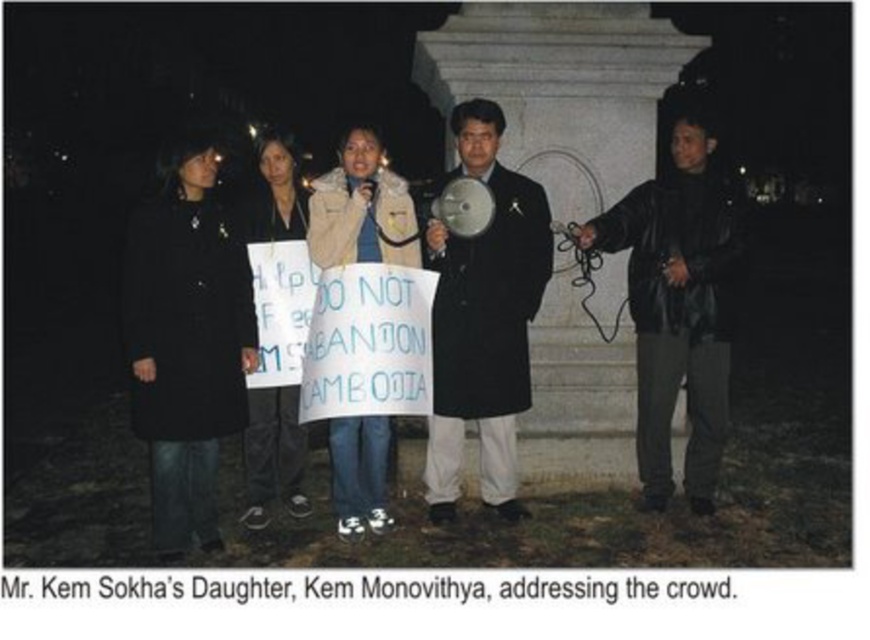
Question: Which object is farther from the camera taking this photo?

Choices:
 (A) black matte coat at center
 (B) beige fleece jacket at center

Answer: (B)

Question: Is leather jacket at right behind black fabric jacket at center?

Choices:
 (A) yes
 (B) no

Answer: (A)

Question: Which object is the closest to the matte black coat at center?

Choices:
 (A) leather jacket at right
 (B) black fabric jacket at center

Answer: (B)

Question: Which of these objects is positioned farthest from the black fabric jacket at center?

Choices:
 (A) leather jacket at right
 (B) beige fleece jacket at center
 (C) matte black coat at center

Answer: (A)

Question: Is leather jacket at right to the right of beige fleece jacket at center from the viewer's perspective?

Choices:
 (A) no
 (B) yes

Answer: (B)

Question: Can you confirm if black matte coat at center is bigger than beige fleece jacket at center?

Choices:
 (A) no
 (B) yes

Answer: (B)